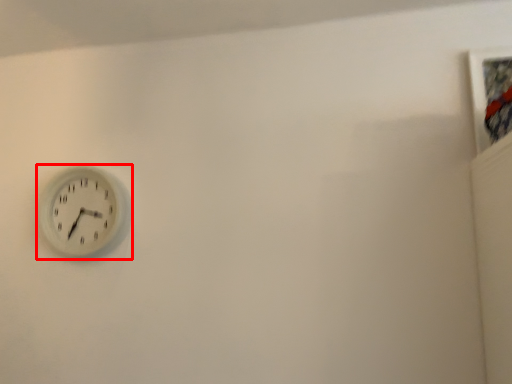
Question: From the image's perspective, where is wall clock (annotated by the red box) located relative to picture frame?

Choices:
 (A) above
 (B) below

Answer: (B)